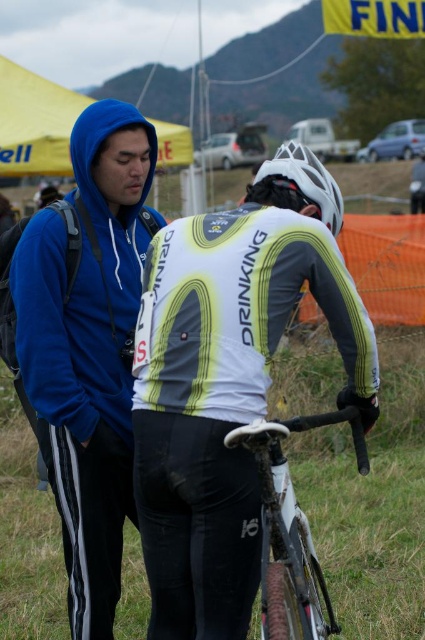
Question: Which object appears closest to the camera in this image?

Choices:
 (A) blue fleece jacket at left
 (B) white matte bicycle at center
 (C) white matte bicycle helmet at center

Answer: (B)

Question: Which is nearer to the blue fleece jacket at left?

Choices:
 (A) white matte bicycle handlebars at center
 (B) white matte bicycle helmet at center
 (C) white matte bicycle at center

Answer: (C)

Question: Is blue fleece jacket at left bigger than white matte bicycle helmet at center?

Choices:
 (A) yes
 (B) no

Answer: (B)

Question: Can you confirm if white matte bicycle at center is positioned above white matte bicycle handlebars at center?

Choices:
 (A) no
 (B) yes

Answer: (B)

Question: Which object is positioned closest to the white matte bicycle helmet at center?

Choices:
 (A) white matte bicycle at center
 (B) white matte bicycle handlebars at center

Answer: (A)

Question: Where is blue fleece jacket at left located in relation to white matte bicycle handlebars at center in the image?

Choices:
 (A) right
 (B) left

Answer: (B)